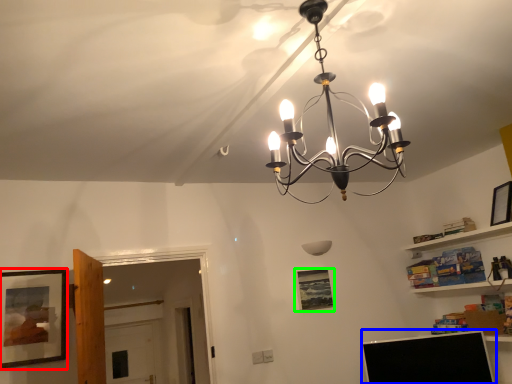
Question: Considering the real-world distances, which object is farthest from picture frame (highlighted by a red box)? computer monitor (highlighted by a blue box) or picture frame (highlighted by a green box)?

Choices:
 (A) computer monitor
 (B) picture frame

Answer: (A)